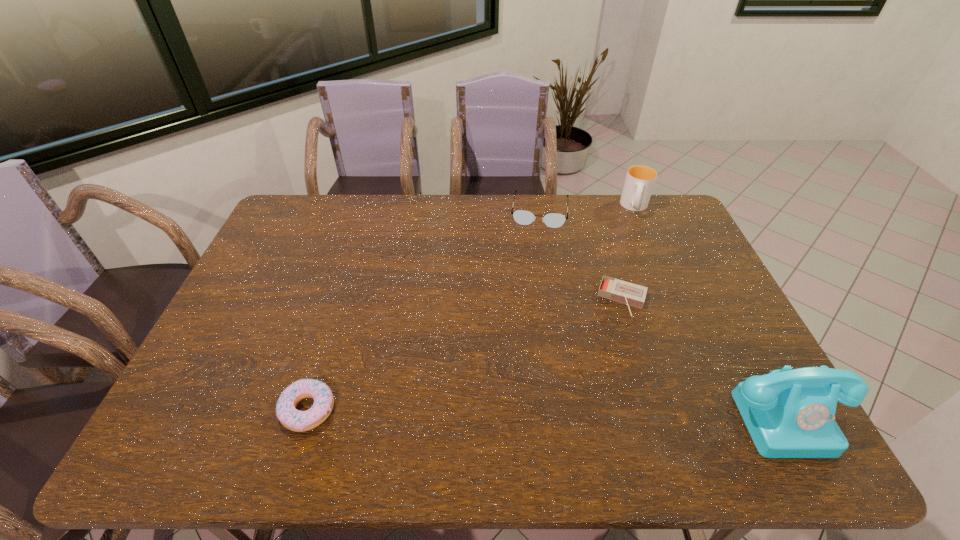
At what (x,y) coordinates should I click in order to perform the action: click on vacant space on the desktop that is between the second shortest object and the tallest object and is positioned on the striking surface of the matchbox. Please return your answer as a coordinate pair (x, y). The height and width of the screenshot is (540, 960). Looking at the image, I should click on (591, 412).

Where is `vacant spot on the desktop that is between the leftmost object and the tallest object and is positioned on the lenses of the spectacles`? vacant spot on the desktop that is between the leftmost object and the tallest object and is positioned on the lenses of the spectacles is located at coordinates (518, 411).

The width and height of the screenshot is (960, 540). Find the location of `vacant space on the desktop that is between the leftmost object and the telephone and is positioned with the handle on the side of the fourth shortest object`. vacant space on the desktop that is between the leftmost object and the telephone and is positioned with the handle on the side of the fourth shortest object is located at coordinates (614, 412).